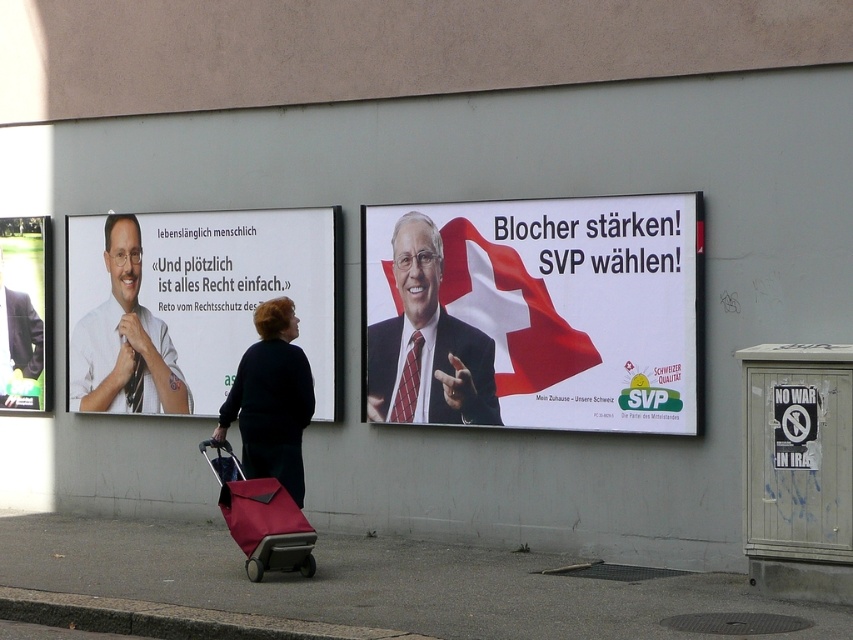
Question: Does matte black poster at center have a lesser width compared to matte white shirt at left?

Choices:
 (A) yes
 (B) no

Answer: (B)

Question: Is matte black poster at center to the left of black fabric coat at center from the viewer's perspective?

Choices:
 (A) no
 (B) yes

Answer: (A)

Question: Which of the following is the farthest from the observer?

Choices:
 (A) (258, 426)
 (B) (39, 237)
 (C) (408, 416)
 (D) (308, 570)

Answer: (B)

Question: Which of the following is the farthest from the observer?

Choices:
 (A) (129, 330)
 (B) (456, 362)
 (C) (212, 440)

Answer: (A)

Question: Is matte white poster at left smaller than black fabric coat at center?

Choices:
 (A) yes
 (B) no

Answer: (B)

Question: Estimate the real-world distances between objects in this image. Which object is farther from the matte white shirt at left?

Choices:
 (A) matte red suitcase at center
 (B) red tie at center
 (C) smooth asphalt pavement at lower center
 (D) matte black jacket at upper left

Answer: (A)